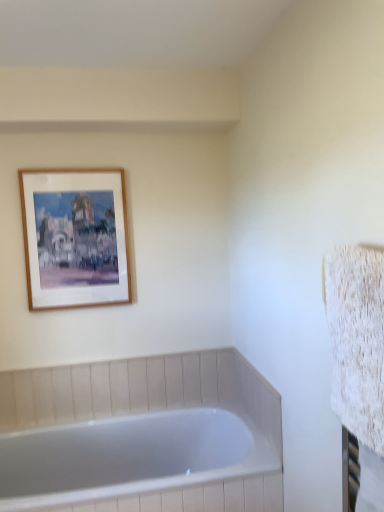
The width and height of the screenshot is (384, 512). Identify the location of wooden frame at upper left. (75, 238).

What do you see at coordinates (75, 238) in the screenshot? The height and width of the screenshot is (512, 384). I see `wooden frame at upper left` at bounding box center [75, 238].

Where is `white glossy bathtub at lower left`? The image size is (384, 512). white glossy bathtub at lower left is located at coordinates (142, 436).

Describe the element at coordinates (142, 436) in the screenshot. I see `white glossy bathtub at lower left` at that location.

What is the approximate width of white glossy bathtub at lower left?

27.61 inches.

The width and height of the screenshot is (384, 512). I want to click on wooden frame at upper left, so 75,238.

Considering the positions of objects white glossy bathtub at lower left and wooden frame at upper left in the image provided, who is more to the right, white glossy bathtub at lower left or wooden frame at upper left?

white glossy bathtub at lower left.

Looking at this image, which object is further away from the camera taking this photo, white glossy bathtub at lower left or wooden frame at upper left?

wooden frame at upper left.

Is point (154, 496) behind point (53, 224)?

No, it is not.

From the image's perspective, is white glossy bathtub at lower left on top of wooden frame at upper left?

No, from the image's perspective, white glossy bathtub at lower left is not above wooden frame at upper left.

From a real-world perspective, is white glossy bathtub at lower left on wooden frame at upper left?

No, from a real-world perspective, white glossy bathtub at lower left is not on top of wooden frame at upper left.

Can you confirm if white glossy bathtub at lower left is wider than wooden frame at upper left?

Correct, the width of white glossy bathtub at lower left exceeds that of wooden frame at upper left.

Is white glossy bathtub at lower left taller or shorter than wooden frame at upper left?

In the image, white glossy bathtub at lower left appears to be shorter than wooden frame at upper left.

Is white glossy bathtub at lower left smaller than wooden frame at upper left?

No, white glossy bathtub at lower left is not smaller than wooden frame at upper left.

Is white glossy bathtub at lower left surrounding wooden frame at upper left?

No, wooden frame at upper left is not inside white glossy bathtub at lower left.

Is the surface of white glossy bathtub at lower left in direct contact with wooden frame at upper left?

There is a gap between white glossy bathtub at lower left and wooden frame at upper left.

Is white glossy bathtub at lower left facing towards wooden frame at upper left?

No, white glossy bathtub at lower left is not turned towards wooden frame at upper left.

The image size is (384, 512). In the image, there is a wooden frame at upper left. Identify the location of bathtub below it (from a real-world perspective). (142, 436).

Considering the relative positions of wooden frame at upper left and white glossy bathtub at lower left in the image provided, is wooden frame at upper left to the left or to the right of white glossy bathtub at lower left?

wooden frame at upper left is positioned on white glossy bathtub at lower left's left side.

In the image, is wooden frame at upper left positioned in front of or behind white glossy bathtub at lower left?

In the image, wooden frame at upper left appears behind white glossy bathtub at lower left.

Does point (59, 212) come in front of point (36, 479)?

Yes, point (59, 212) is closer to viewer.

From the image's perspective, which is above, wooden frame at upper left or white glossy bathtub at lower left?

wooden frame at upper left, from the image's perspective.

From a real-world perspective, is wooden frame at upper left located higher than white glossy bathtub at lower left?

Yes, from a real-world perspective, wooden frame at upper left is on top of white glossy bathtub at lower left.

Is wooden frame at upper left thinner than white glossy bathtub at lower left?

Yes, wooden frame at upper left is thinner than white glossy bathtub at lower left.

Looking at this image, considering the sizes of objects wooden frame at upper left and white glossy bathtub at lower left in the image provided, who is shorter, wooden frame at upper left or white glossy bathtub at lower left?

white glossy bathtub at lower left is shorter.

Considering the relative sizes of wooden frame at upper left and white glossy bathtub at lower left in the image provided, is wooden frame at upper left smaller than white glossy bathtub at lower left?

Yes, wooden frame at upper left is smaller than white glossy bathtub at lower left.

Would you say wooden frame at upper left is inside or outside white glossy bathtub at lower left?

wooden frame at upper left cannot be found inside white glossy bathtub at lower left.

Based on the photo, are wooden frame at upper left and white glossy bathtub at lower left beside each other?

wooden frame at upper left and white glossy bathtub at lower left are not in contact.

Could you tell me if wooden frame at upper left is turned towards white glossy bathtub at lower left?

No.

Locate an element on the screen. The image size is (384, 512). bathtub that appears below the wooden frame at upper left (from a real-world perspective) is located at coordinates (142, 436).

This screenshot has height=512, width=384. What are the coordinates of `picture frame on the left of white glossy bathtub at lower left` in the screenshot? It's located at (75, 238).

Image resolution: width=384 pixels, height=512 pixels. In order to click on picture frame above the white glossy bathtub at lower left (from the image's perspective) in this screenshot , I will do `click(75, 238)`.